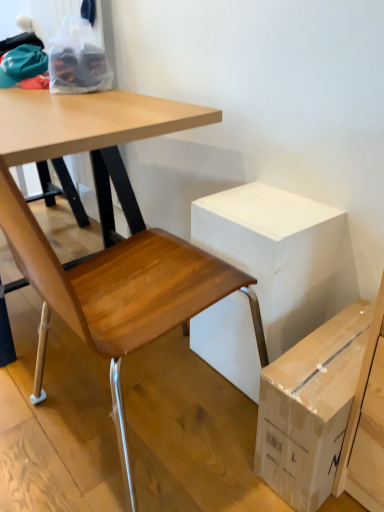
This screenshot has width=384, height=512. In order to click on free space to the left of white cardboard box at center in this screenshot , I will do `click(162, 379)`.